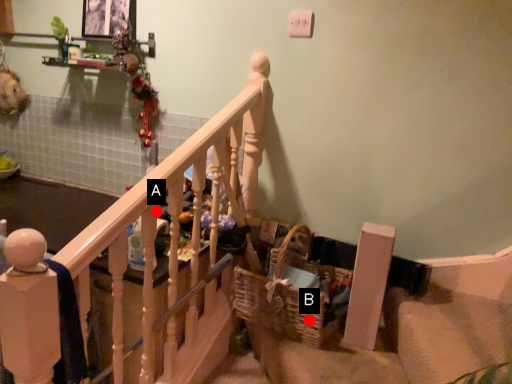
Question: Two points are circled on the image, labeled by A and B beside each circle. Which point is farther to the camera?

Choices:
 (A) A is further
 (B) B is further

Answer: (B)